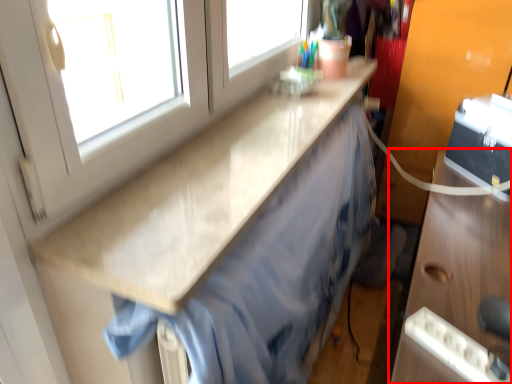
Question: From the image's perspective, where is cabinetry (annotated by the red box) located relative to countertop?

Choices:
 (A) below
 (B) above

Answer: (A)